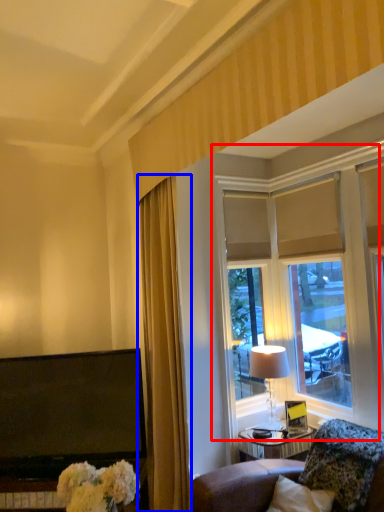
Question: Among these objects, which one is nearest to the camera, window (highlighted by a red box) or curtain (highlighted by a blue box)?

Choices:
 (A) window
 (B) curtain

Answer: (B)